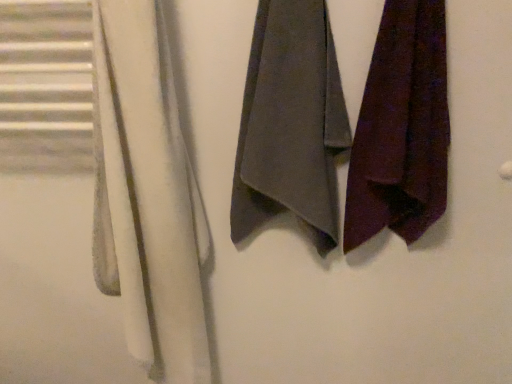
Describe the element at coordinates (150, 194) in the screenshot. The image size is (512, 384). I see `white soft towel at left` at that location.

In order to face dark purple fabric at right, the second towel positioned from the left, should I rotate leftwards or rightwards?

Turn right by 19.153 degrees to look at dark purple fabric at right, the second towel positioned from the left.

At what (x,y) coordinates should I click in order to perform the action: click on white soft towel at left. Please return your answer as a coordinate pair (x, y). Looking at the image, I should click on (150, 194).

Which is correct: dark gray fabric towel at center, arranged as the 2th towel when viewed from the right, is inside white soft towel at left, or outside of it?

dark gray fabric towel at center, arranged as the 2th towel when viewed from the right, exists outside the volume of white soft towel at left.

Is dark gray fabric towel at center, arranged as the 2th towel when viewed from the right, positioned far away from white soft towel at left?

No, dark gray fabric towel at center, arranged as the 2th towel when viewed from the right, is not far away from white soft towel at left.

Consider the image. Which of these two, dark gray fabric towel at center, which ranks as the first towel in left-to-right order, or white soft towel at left, stands taller?

Standing taller between the two is white soft towel at left.

Considering the relative sizes of dark gray fabric towel at center, which ranks as the first towel in left-to-right order, and white soft towel at left in the image provided, is dark gray fabric towel at center, which ranks as the first towel in left-to-right order, thinner than white soft towel at left?

Indeed, dark gray fabric towel at center, which ranks as the first towel in left-to-right order, has a lesser width compared to white soft towel at left.

Based on the photo, is dark purple fabric at right, the first towel when ordered from right to left, at the back of white soft towel at left?

No, white soft towel at left is not facing the opposite direction of dark purple fabric at right, the first towel when ordered from right to left.

Can you confirm if white soft towel at left is taller than dark purple fabric at right, the second towel positioned from the left?

Correct, white soft towel at left is much taller as dark purple fabric at right, the second towel positioned from the left.

Is white soft towel at left in front of dark purple fabric at right, the first towel when ordered from right to left?

Yes, white soft towel at left is closer to the viewer.

Looking at the image, does dark gray fabric towel at center, arranged as the 2th towel when viewed from the right, seem bigger or smaller compared to dark purple fabric at right, the second towel positioned from the left?

dark gray fabric towel at center, arranged as the 2th towel when viewed from the right, is bigger than dark purple fabric at right, the second towel positioned from the left.

Does dark gray fabric towel at center, arranged as the 2th towel when viewed from the right, have a greater height compared to dark purple fabric at right, the first towel when ordered from right to left?

Correct, dark gray fabric towel at center, arranged as the 2th towel when viewed from the right, is much taller as dark purple fabric at right, the first towel when ordered from right to left.

Is dark purple fabric at right, the second towel positioned from the left, located within dark gray fabric towel at center, which ranks as the first towel in left-to-right order?

That's incorrect, dark purple fabric at right, the second towel positioned from the left, is not inside dark gray fabric towel at center, which ranks as the first towel in left-to-right order.

In the scene shown: Does dark gray fabric towel at center, which ranks as the first towel in left-to-right order, have a lesser width compared to dark purple fabric at right, the first towel when ordered from right to left?

Yes, dark gray fabric towel at center, which ranks as the first towel in left-to-right order, is thinner than dark purple fabric at right, the first towel when ordered from right to left.

How much distance is there between dark purple fabric at right, the second towel positioned from the left, and dark gray fabric towel at center, arranged as the 2th towel when viewed from the right?

dark purple fabric at right, the second towel positioned from the left, and dark gray fabric towel at center, arranged as the 2th towel when viewed from the right, are 5.49 inches apart from each other.

From a real-world perspective, who is located higher, dark purple fabric at right, the first towel when ordered from right to left, or dark gray fabric towel at center, which ranks as the first towel in left-to-right order?

In real-world perspective, dark gray fabric towel at center, which ranks as the first towel in left-to-right order, is above.

Is dark purple fabric at right, the second towel positioned from the left, positioned far away from dark gray fabric towel at center, arranged as the 2th towel when viewed from the right?

No, dark purple fabric at right, the second towel positioned from the left, is in close proximity to dark gray fabric towel at center, arranged as the 2th towel when viewed from the right.

From the image's perspective, relative to dark gray fabric towel at center, arranged as the 2th towel when viewed from the right, is dark purple fabric at right, the second towel positioned from the left, above or below?

dark purple fabric at right, the second towel positioned from the left, is situated lower than dark gray fabric towel at center, arranged as the 2th towel when viewed from the right, in the image.

Is dark purple fabric at right, the second towel positioned from the left, wider than white soft towel at left?

No.

Which is in front, point (389, 71) or point (126, 19)?

Point (126, 19)

Looking at this image, in the image, is dark purple fabric at right, the first towel when ordered from right to left, positioned in front of or behind white soft towel at left?

In the image, dark purple fabric at right, the first towel when ordered from right to left, appears behind white soft towel at left.

Considering the sizes of objects dark purple fabric at right, the second towel positioned from the left, and white soft towel at left in the image provided, who is taller, dark purple fabric at right, the second towel positioned from the left, or white soft towel at left?

With more height is white soft towel at left.

In the scene shown: Is dark gray fabric towel at center, which ranks as the first towel in left-to-right order, inside white soft towel at left?

That's incorrect, dark gray fabric towel at center, which ranks as the first towel in left-to-right order, is not inside white soft towel at left.

From the image's perspective, does white soft towel at left appear higher than dark gray fabric towel at center, arranged as the 2th towel when viewed from the right?

No.

Consider the image. Is white soft towel at left positioned far away from dark gray fabric towel at center, which ranks as the first towel in left-to-right order?

That's not correct — white soft towel at left is a little close to dark gray fabric towel at center, which ranks as the first towel in left-to-right order.

Can you confirm if white soft towel at left is smaller than dark gray fabric towel at center, arranged as the 2th towel when viewed from the right?

No, white soft towel at left is not smaller than dark gray fabric towel at center, arranged as the 2th towel when viewed from the right.

Locate an element on the screen. cloth in front of the dark gray fabric towel at center, arranged as the 2th towel when viewed from the right is located at coordinates (150, 194).

Find the location of a particular element. towel that is the 1st object above the white soft towel at left (from a real-world perspective) is located at coordinates (401, 128).

Considering their positions, is white soft towel at left positioned further to dark purple fabric at right, the second towel positioned from the left, than dark gray fabric towel at center, arranged as the 2th towel when viewed from the right?

Based on the image, white soft towel at left appears to be further to dark purple fabric at right, the second towel positioned from the left.

From the picture: Looking at the image, which one is located further to white soft towel at left, dark gray fabric towel at center, which ranks as the first towel in left-to-right order, or dark purple fabric at right, the second towel positioned from the left?

dark purple fabric at right, the second towel positioned from the left, lies further to white soft towel at left than the other object.

From the image, which object appears to be nearer to dark gray fabric towel at center, which ranks as the first towel in left-to-right order, white soft towel at left or dark purple fabric at right, the second towel positioned from the left?

Based on the image, dark purple fabric at right, the second towel positioned from the left, appears to be nearer to dark gray fabric towel at center, which ranks as the first towel in left-to-right order.

Considering their positions, is dark purple fabric at right, the second towel positioned from the left, positioned further to white soft towel at left than dark gray fabric towel at center, which ranks as the first towel in left-to-right order?

dark purple fabric at right, the second towel positioned from the left, lies further to white soft towel at left than the other object.

Based on the photo, looking at the image, which one is located closer to dark gray fabric towel at center, which ranks as the first towel in left-to-right order, dark purple fabric at right, the second towel positioned from the left, or white soft towel at left?

dark purple fabric at right, the second towel positioned from the left, is positioned closer to the anchor dark gray fabric towel at center, which ranks as the first towel in left-to-right order.

Based on their spatial positions, is dark gray fabric towel at center, which ranks as the first towel in left-to-right order, or white soft towel at left further from dark purple fabric at right, the first towel when ordered from right to left?

white soft towel at left lies further to dark purple fabric at right, the first towel when ordered from right to left, than the other object.

Find the location of a particular element. The height and width of the screenshot is (384, 512). towel located between white soft towel at left and dark purple fabric at right, the first towel when ordered from right to left, in the left-right direction is located at coordinates (290, 123).